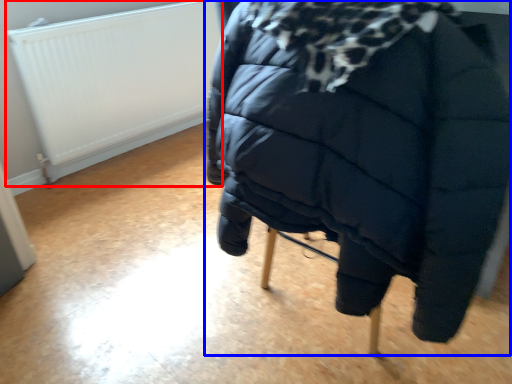
Question: Which of the following is the farthest to the observer, radiator (highlighted by a red box) or furniture (highlighted by a blue box)?

Choices:
 (A) radiator
 (B) furniture

Answer: (A)